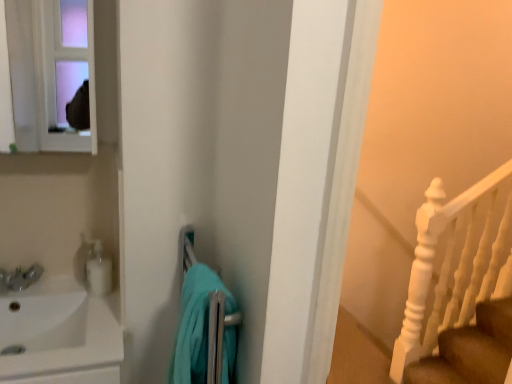
Question: Does teal fabric towel at center have a greater width compared to matte white medicine cabinet at upper left?

Choices:
 (A) no
 (B) yes

Answer: (B)

Question: Is teal fabric towel at center not close to matte white medicine cabinet at upper left?

Choices:
 (A) yes
 (B) no

Answer: (A)

Question: Is teal fabric towel at center further to the viewer compared to matte white medicine cabinet at upper left?

Choices:
 (A) yes
 (B) no

Answer: (B)

Question: From a real-world perspective, is teal fabric towel at center on top of matte white medicine cabinet at upper left?

Choices:
 (A) yes
 (B) no

Answer: (B)

Question: Is teal fabric towel at center smaller than matte white medicine cabinet at upper left?

Choices:
 (A) no
 (B) yes

Answer: (A)

Question: Is white glossy soap dispenser at left in front of or behind white glossy sink at left in the image?

Choices:
 (A) behind
 (B) front

Answer: (A)

Question: Is white glossy soap dispenser at left wider or thinner than white glossy sink at left?

Choices:
 (A) thin
 (B) wide

Answer: (A)

Question: Considering the positions of point (96, 289) and point (11, 294), is point (96, 289) closer or farther from the camera than point (11, 294)?

Choices:
 (A) closer
 (B) farther

Answer: (A)

Question: From the image's perspective, is white glossy soap dispenser at left located above or below white glossy sink at left?

Choices:
 (A) below
 (B) above

Answer: (B)

Question: From a real-world perspective, is matte white medicine cabinet at upper left above or below white glossy soap dispenser at left?

Choices:
 (A) above
 (B) below

Answer: (A)

Question: Which is correct: matte white medicine cabinet at upper left is inside white glossy soap dispenser at left, or outside of it?

Choices:
 (A) inside
 (B) outside

Answer: (B)

Question: Considering the positions of matte white medicine cabinet at upper left and white glossy soap dispenser at left in the image, is matte white medicine cabinet at upper left wider or thinner than white glossy soap dispenser at left?

Choices:
 (A) wide
 (B) thin

Answer: (B)

Question: From the image's perspective, is matte white medicine cabinet at upper left above or below white glossy soap dispenser at left?

Choices:
 (A) below
 (B) above

Answer: (B)

Question: Considering the positions of point (4, 380) and point (20, 109), is point (4, 380) closer or farther from the camera than point (20, 109)?

Choices:
 (A) closer
 (B) farther

Answer: (A)

Question: Choose the correct answer: Is white glossy sink at left inside matte white medicine cabinet at upper left or outside it?

Choices:
 (A) inside
 (B) outside

Answer: (B)